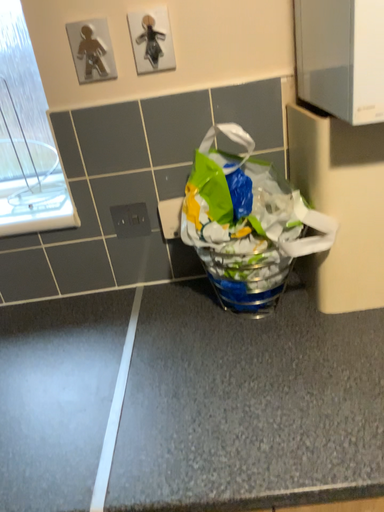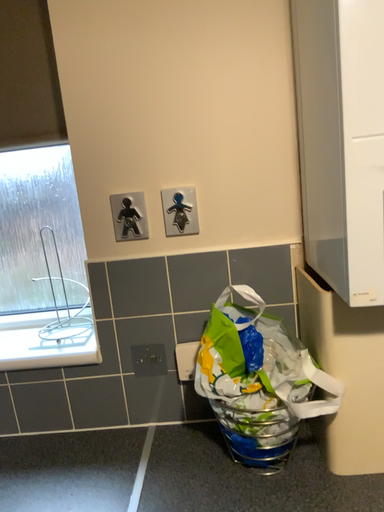
Question: How did the camera likely rotate when shooting the video?

Choices:
 (A) rotated downward
 (B) rotated upward

Answer: (B)